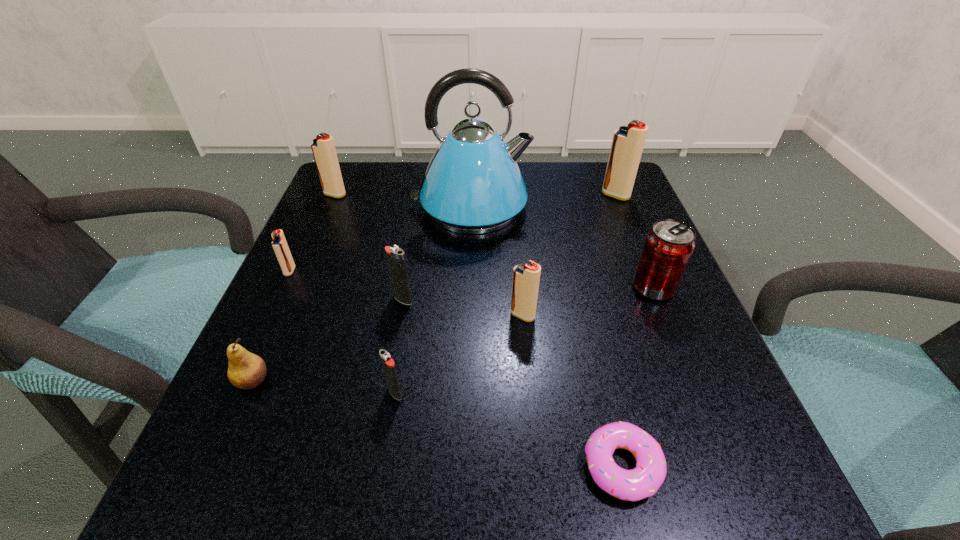
Find the location of a particular element. kettle is located at coordinates (473, 185).

The height and width of the screenshot is (540, 960). I want to click on the biggest red igniter, so click(627, 145).

Locate an element on the screen. This screenshot has width=960, height=540. the rightmost igniter is located at coordinates (627, 145).

Locate an element on the screen. the fifth shortest igniter is located at coordinates (323, 148).

This screenshot has width=960, height=540. Find the location of `pop soda`. pop soda is located at coordinates (668, 247).

Locate an element on the screen. the farther black igniter is located at coordinates (395, 256).

Find the location of `the third nearest igniter`. the third nearest igniter is located at coordinates (395, 256).

What are the coordinates of `the seventh farthest object` in the screenshot? It's located at (526, 277).

What are the coordinates of `the second igniter from right to left` in the screenshot? It's located at (526, 277).

At what (x,y) coordinates should I click in order to perform the action: click on pear. Please return your answer as a coordinate pair (x, y). This screenshot has height=540, width=960. Looking at the image, I should click on (246, 370).